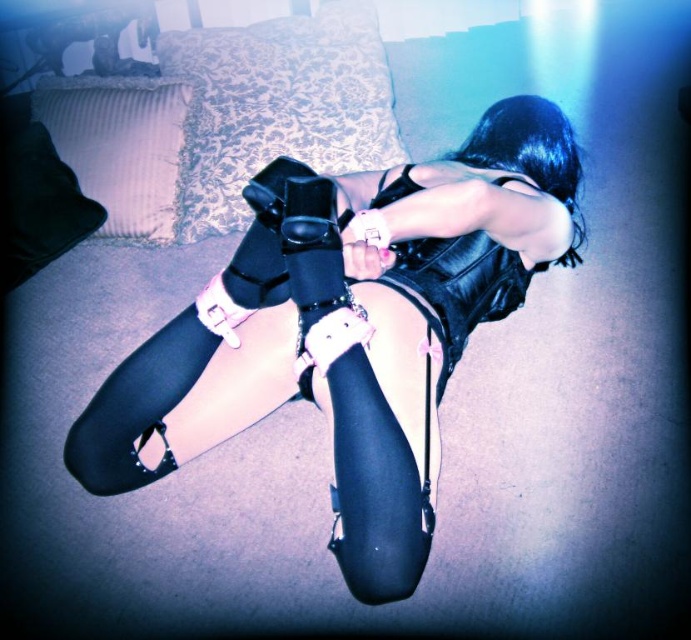
Question: Which object is closer to the camera taking this photo?

Choices:
 (A) black leather gloves at center
 (B) white fabric pillow at upper left

Answer: (A)

Question: Is velvet-patterned pillow at upper center thinner than black leather corset at center?

Choices:
 (A) yes
 (B) no

Answer: (B)

Question: Based on their relative distances, which object is nearer to the black leather corset at center?

Choices:
 (A) white fabric pillow at upper left
 (B) velvet-patterned pillow at upper center

Answer: (B)

Question: Which is nearer to the black leather gloves at center?

Choices:
 (A) white fabric pillow at upper left
 (B) velvet-patterned pillow at upper center
 (C) black leather corset at center

Answer: (C)

Question: Is black leather gloves at center to the right of white fabric pillow at upper left from the viewer's perspective?

Choices:
 (A) no
 (B) yes

Answer: (B)

Question: Is velvet-patterned pillow at upper center thinner than white fabric pillow at upper left?

Choices:
 (A) yes
 (B) no

Answer: (B)